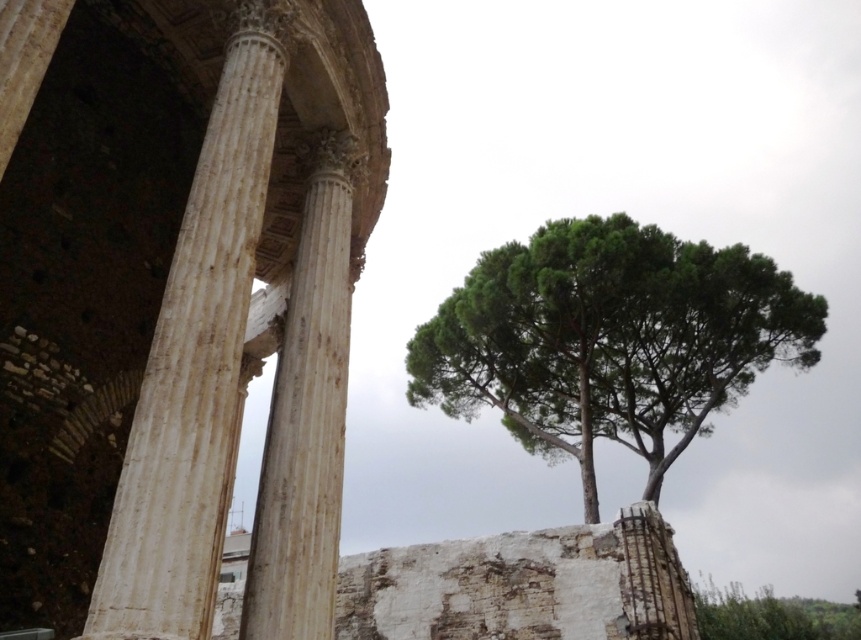
Does point (709, 355) come closer to viewer compared to point (225, 145)?

No, it is not.

Does green leafy tree at upper right lie behind white marble column at left?

Yes, green leafy tree at upper right is behind white marble column at left.

Is point (459, 371) closer to viewer compared to point (186, 605)?

No.

Locate an element on the screen. The image size is (861, 640). green leafy tree at upper right is located at coordinates (609, 339).

Is white marble column at left positioned behind white marble column at center?

No, it is in front of white marble column at center.

Does point (224, 280) come closer to viewer compared to point (308, 403)?

Yes, it is.

You are a GUI agent. You are given a task and a screenshot of the screen. Output one action in this format:
    pyautogui.click(x=<x>, y=<y>)
    Task: Click on the white marble column at left
    
    Given the screenshot: What is the action you would take?
    pyautogui.click(x=194, y=371)

Is green leafy tree at upper right closer to camera compared to white marble column at center?

No.

Is point (586, 509) positioned in front of point (325, 172)?

No, it is behind (325, 172).

Identify the location of green leafy tree at upper right. (609, 339).